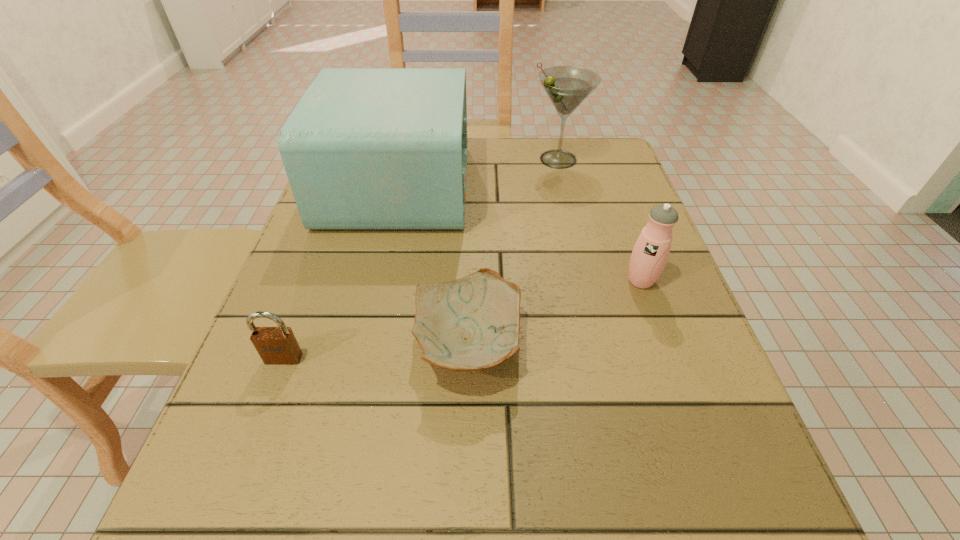
I want to click on empty space that is in between the padlock and the radio receiver, so click(341, 272).

Where is `unoccupied area between the pottery and the third nearest object`? unoccupied area between the pottery and the third nearest object is located at coordinates tap(555, 312).

Locate an element on the screen. The width and height of the screenshot is (960, 540). the closest object relative to the martini is located at coordinates (365, 148).

Select which object appears as the fourth closest to the shortest object. Please provide its 2D coordinates. Your answer should be formatted as a tuple, i.e. [(x, y)], where the tuple contains the x and y coordinates of a point satisfying the conditions above.

[(567, 87)]

Where is `free space in the image that satisfies the following two spatial constraints: 1. on the front panel of the radio receiver; 2. on the right side of the shortest object`? free space in the image that satisfies the following two spatial constraints: 1. on the front panel of the radio receiver; 2. on the right side of the shortest object is located at coordinates (361, 344).

Image resolution: width=960 pixels, height=540 pixels. Find the location of `vacant region that satisfies the following two spatial constraints: 1. on the back side of the pottery; 2. on the left side of the martini`. vacant region that satisfies the following two spatial constraints: 1. on the back side of the pottery; 2. on the left side of the martini is located at coordinates (472, 159).